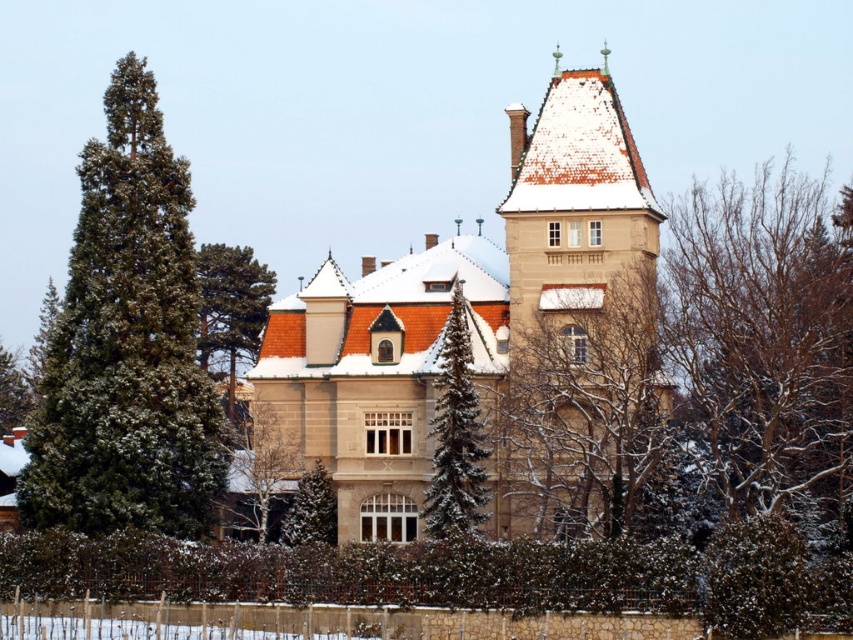
Question: Does green textured pine tree at left have a larger size compared to bare branches at right?

Choices:
 (A) no
 (B) yes

Answer: (B)

Question: Which object is the farthest from the brown stone tower at upper center?

Choices:
 (A) bare branches at right
 (B) green textured pine tree at center

Answer: (A)

Question: Considering the real-world distances, which object is farthest from the green textured pine tree at lower left?

Choices:
 (A) snow-covered evergreen tree at center
 (B) beige stone palace at center
 (C) bare branches at right
 (D) brown stone tower at upper center

Answer: (C)

Question: Can you confirm if brown stone tower at upper center is wider than snow-covered evergreen tree at center?

Choices:
 (A) yes
 (B) no

Answer: (A)

Question: Can you confirm if snow-covered evergreen tree at center is positioned above green textured pine tree at lower left?

Choices:
 (A) no
 (B) yes

Answer: (A)

Question: Which object is the farthest from the green textured pine tree at left?

Choices:
 (A) green textured pine tree at center
 (B) brown stone tower at upper center
 (C) beige stone palace at center

Answer: (B)